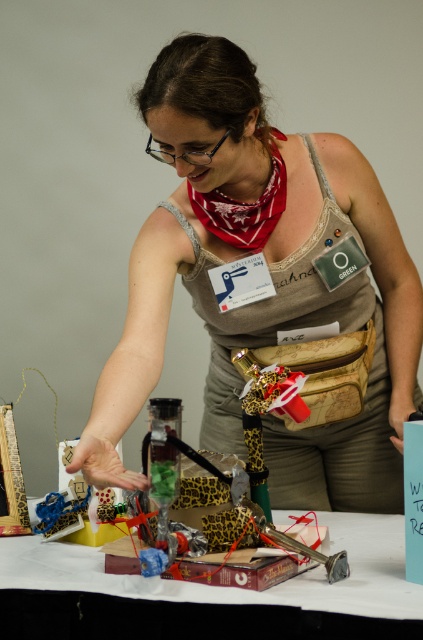
Does point (238, 138) come farther from viewer compared to point (290, 609)?

Yes.

Consider the image. Can you confirm if matte gray tank top at center is positioned to the left of leopard print book at center?

No, matte gray tank top at center is not to the left of leopard print book at center.

This screenshot has width=423, height=640. What do you see at coordinates (271, 276) in the screenshot?
I see `matte gray tank top at center` at bounding box center [271, 276].

The width and height of the screenshot is (423, 640). Identify the location of matte gray tank top at center. (271, 276).